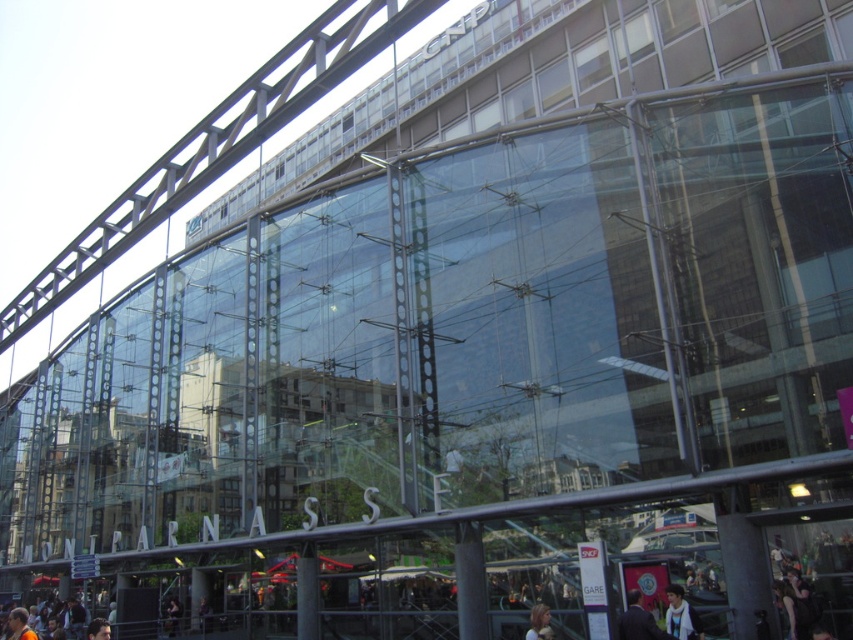
Measure the distance from dark blue suit at lower right to blue denim jacket at lower right.

2.01 meters

Locate an element on the screen. dark blue suit at lower right is located at coordinates (637, 621).

Does blue denim jacket at lower right have a greater height compared to blonde hair at lower center?

Correct, blue denim jacket at lower right is much taller as blonde hair at lower center.

Does point (670, 593) come farther from viewer compared to point (538, 602)?

No, (670, 593) is closer to viewer.

Which is behind, point (682, 604) or point (543, 620)?

Point (543, 620)

At what (x,y) coordinates should I click in order to perform the action: click on blue denim jacket at lower right. Please return your answer as a coordinate pair (x, y). Looking at the image, I should click on (682, 616).

Between point (631, 624) and point (532, 628), which one is positioned in front?

Point (631, 624) is more forward.

How much distance is there between dark blue suit at lower right and blonde hair at lower center?

They are 4.44 meters apart.

At what (x,y) coordinates should I click in order to perform the action: click on dark blue suit at lower right. Please return your answer as a coordinate pair (x, y). Looking at the image, I should click on (637, 621).